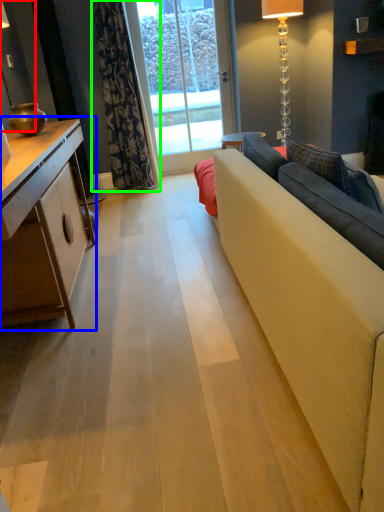
Question: Estimate the real-world distances between objects in this image. Which object is closer to lamp (highlighted by a red box), cabinetry (highlighted by a blue box) or curtain (highlighted by a green box)?

Choices:
 (A) cabinetry
 (B) curtain

Answer: (B)